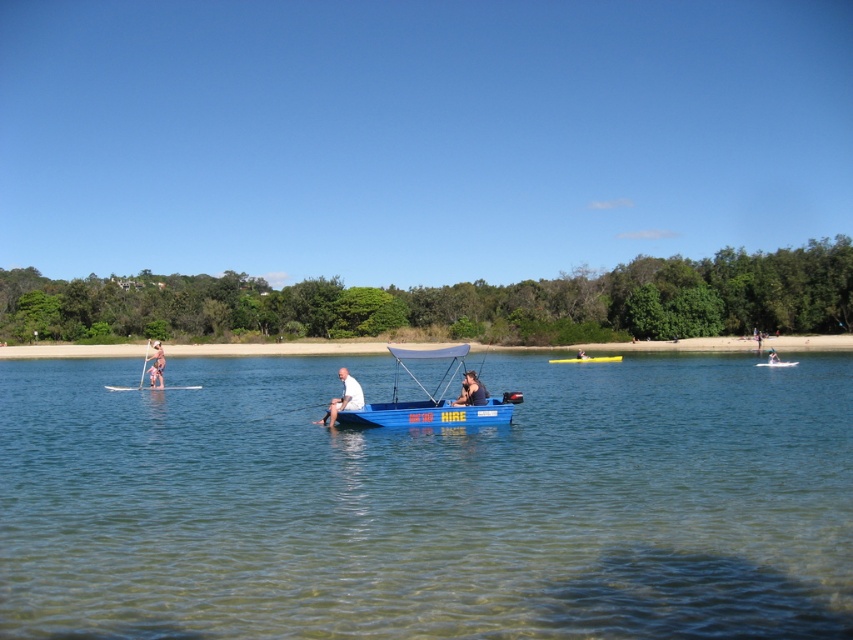
Question: Which point appears farthest from the camera in this image?

Choices:
 (A) (593, 362)
 (B) (463, 401)

Answer: (A)

Question: Which object appears farthest from the camera in this image?

Choices:
 (A) white fabric boat at center
 (B) yellow plastic canoe at center
 (C) tan skin person at center

Answer: (B)

Question: Which of the following is the closest to the observer?

Choices:
 (A) (149, 372)
 (B) (315, 420)
 (C) (432, 365)

Answer: (B)

Question: Is white fabric boat at center in front of blue fabric kayak at center?

Choices:
 (A) no
 (B) yes

Answer: (B)

Question: Considering the relative positions of dark blue fabric boat at center and white foam paddle at left in the image provided, where is dark blue fabric boat at center located with respect to white foam paddle at left?

Choices:
 (A) above
 (B) below

Answer: (A)

Question: Does white fabric boat at center have a larger size compared to white foam paddle at left?

Choices:
 (A) yes
 (B) no

Answer: (B)